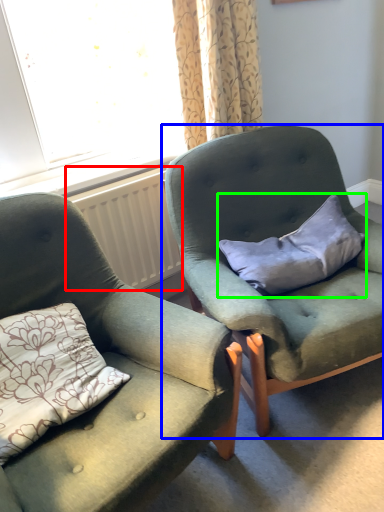
Question: Which object is positioned farthest from radiator (highlighted by a red box)? Select from chair (highlighted by a blue box) and pillow (highlighted by a green box).

Choices:
 (A) chair
 (B) pillow

Answer: (B)